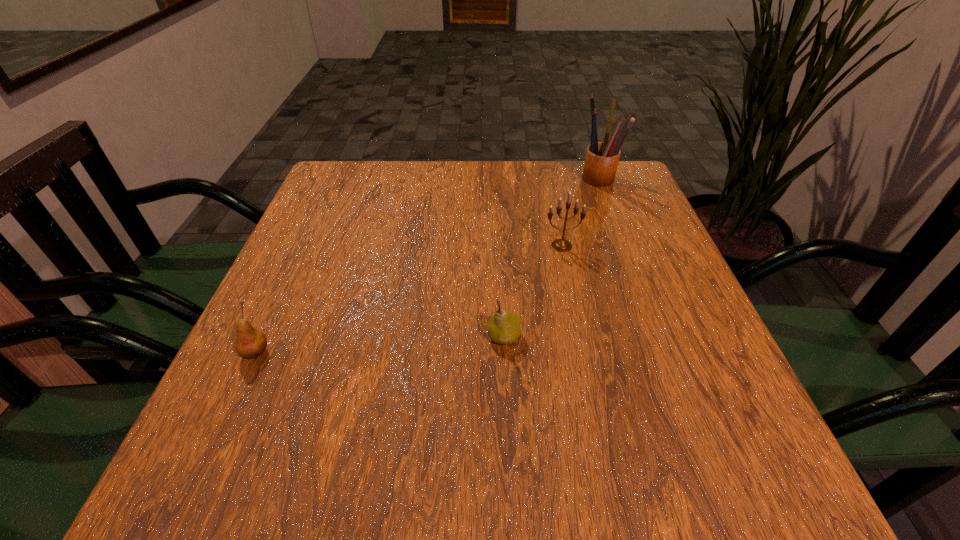
At what (x,y) coordinates should I click in order to perform the action: click on object that is positioned at the far edge. Please return your answer as a coordinate pair (x, y). Looking at the image, I should click on (602, 158).

Find the location of `object that is at the left edge`. object that is at the left edge is located at coordinates (251, 343).

Identify the location of object that is positioned at the right edge. Image resolution: width=960 pixels, height=540 pixels. [602, 158].

You are a GUI agent. You are given a task and a screenshot of the screen. Output one action in this format:
    pyautogui.click(x=<x>, y=<y>)
    Task: Click on the object present at the far right corner
    The height and width of the screenshot is (540, 960).
    Given the screenshot: What is the action you would take?
    pyautogui.click(x=602, y=158)

Locate an element on the screen. Image resolution: width=960 pixels, height=540 pixels. free spot at the far edge of the desktop is located at coordinates (497, 164).

Where is `free space at the near edge of the desktop`? This screenshot has width=960, height=540. free space at the near edge of the desktop is located at coordinates (449, 482).

This screenshot has height=540, width=960. Find the location of `vacant area at the left edge of the desktop`. vacant area at the left edge of the desktop is located at coordinates (349, 291).

Identify the location of vacant space at the right edge of the desktop. (672, 282).

Where is `free space at the far left corner of the desktop`? This screenshot has height=540, width=960. free space at the far left corner of the desktop is located at coordinates (313, 206).

You are a GUI agent. You are given a task and a screenshot of the screen. Output one action in this format:
    pyautogui.click(x=<x>, y=<y>)
    Task: Click on the blank space at the far right corner of the desktop
    Image resolution: width=960 pixels, height=540 pixels.
    Given the screenshot: What is the action you would take?
    pyautogui.click(x=642, y=195)